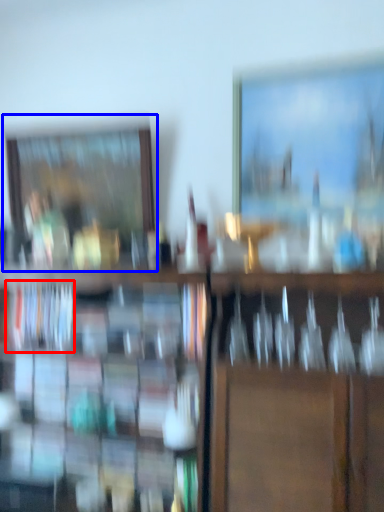
Question: Which object is further to the camera taking this photo, book (highlighted by a red box) or picture frame (highlighted by a blue box)?

Choices:
 (A) book
 (B) picture frame

Answer: (B)